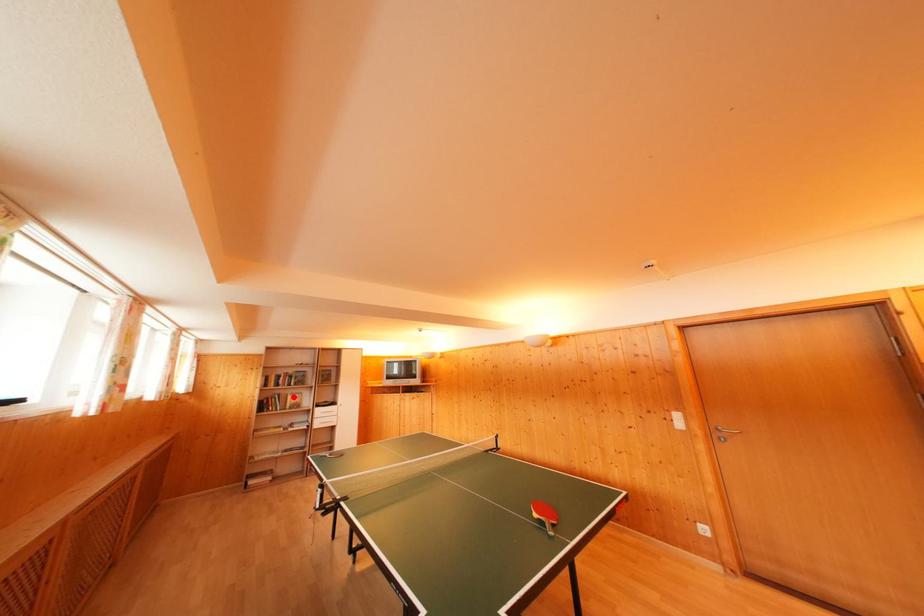
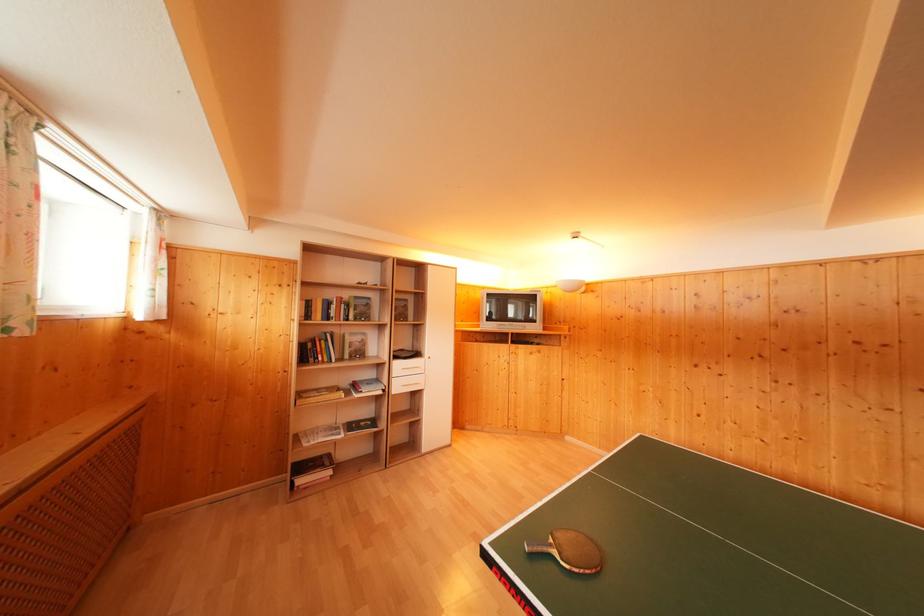
The point at the highlighted location is marked in the first image. Where is the corresponding point in the second image?

(350, 336)